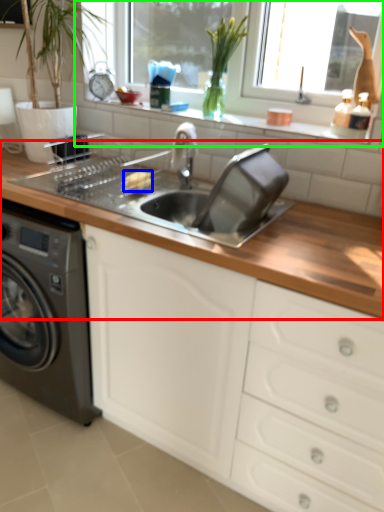
Question: Which is nearer to the countertop (highlighted by a red box)? food (highlighted by a blue box) or window frame (highlighted by a green box).

Choices:
 (A) food
 (B) window frame

Answer: (A)